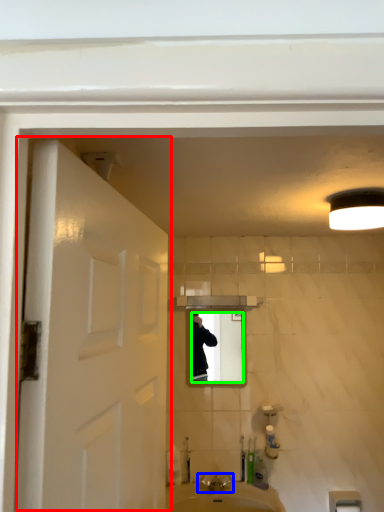
Question: Estimate the real-world distances between objects in this image. Which object is farther from door (highlighted by a red box), tap (highlighted by a blue box) or mirror (highlighted by a green box)?

Choices:
 (A) tap
 (B) mirror

Answer: (A)